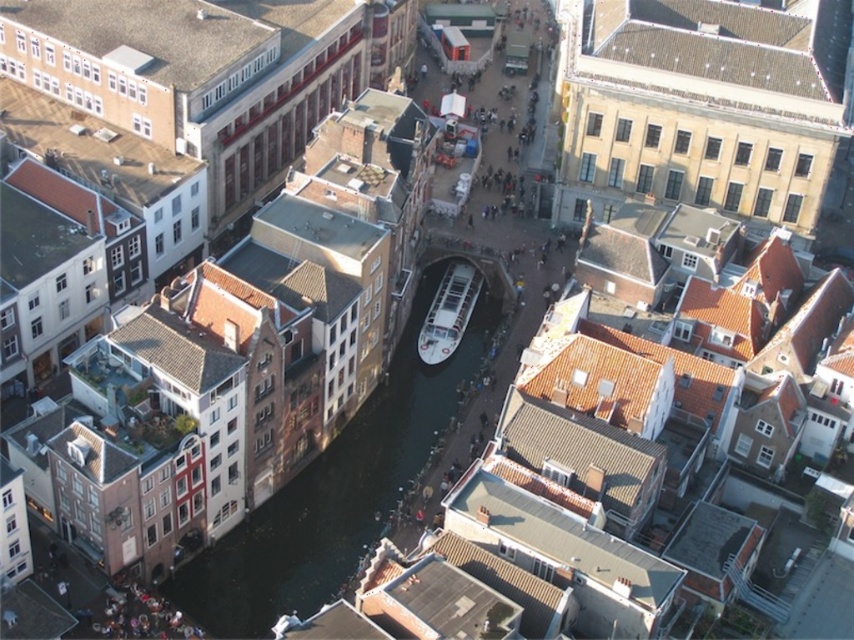
Does point (314, 493) come farther from viewer compared to point (475, 272)?

No, it is not.

Does black smooth water at center appear under white glossy boat at center?

Yes.

What do you see at coordinates (343, 484) in the screenshot?
I see `black smooth water at center` at bounding box center [343, 484].

At what (x,y) coordinates should I click in order to perform the action: click on black smooth water at center. Please return your answer as a coordinate pair (x, y). The height and width of the screenshot is (640, 854). Looking at the image, I should click on pyautogui.click(x=343, y=484).